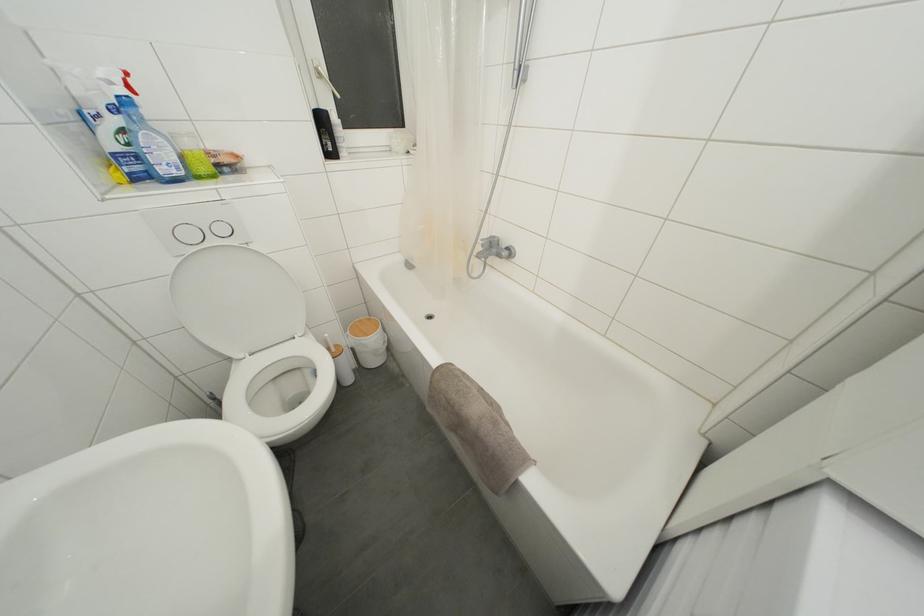
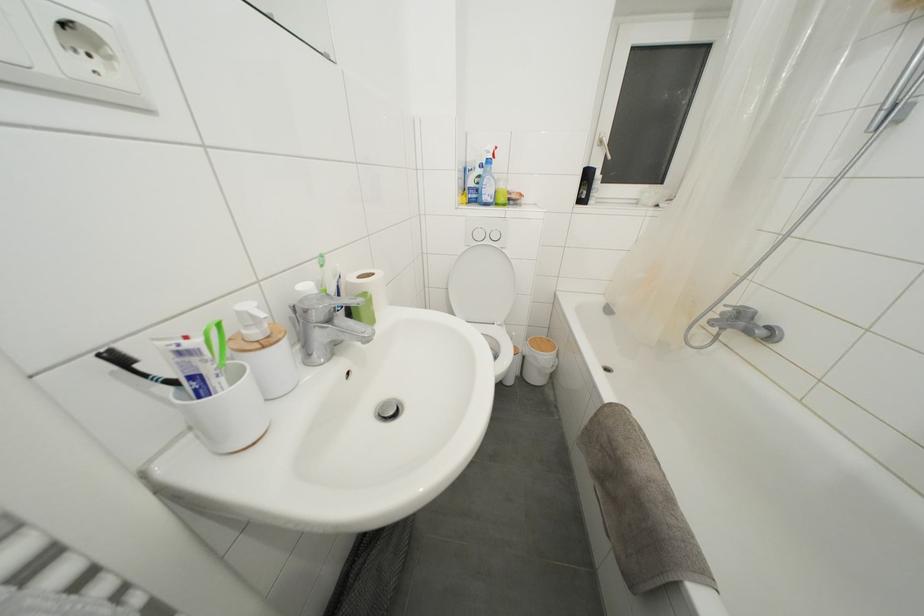
Locate, in the second image, the point that corresponds to (x=363, y=326) in the first image.

(544, 342)